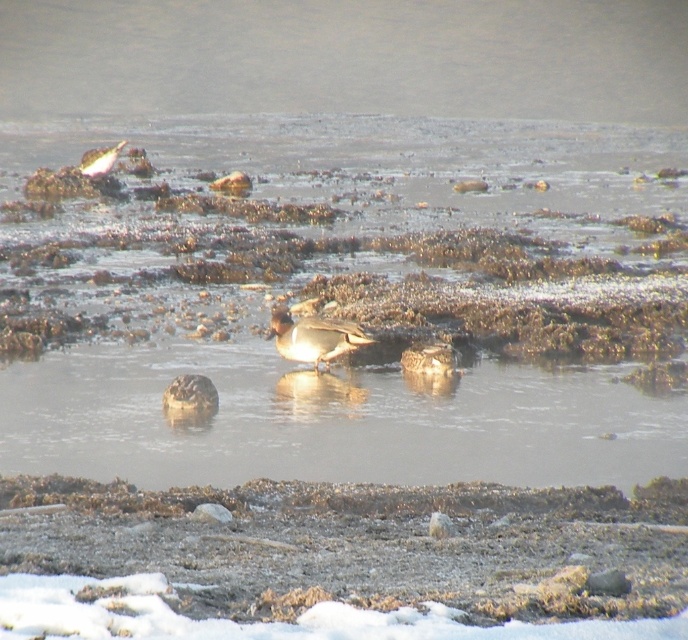
Does clear water at center have a larger size compared to brown speckled duck at center?

Correct, clear water at center is larger in size than brown speckled duck at center.

Find the location of a particular element. clear water at center is located at coordinates (327, 275).

I want to click on clear water at center, so click(327, 275).

Does brown feathered duck at center appear over brown feathered duck at upper left?

No, brown feathered duck at center is not above brown feathered duck at upper left.

Locate an element on the screen. brown feathered duck at center is located at coordinates (314, 337).

Where is `brown feathered duck at center`? brown feathered duck at center is located at coordinates (314, 337).

Image resolution: width=688 pixels, height=640 pixels. I want to click on brown feathered duck at center, so click(314, 337).

Where is `clear water at center`? clear water at center is located at coordinates (327, 275).

From the picture: Who is positioned more to the left, clear water at center or brown feathered duck at upper left?

brown feathered duck at upper left is more to the left.

You are a GUI agent. You are given a task and a screenshot of the screen. Output one action in this format:
    pyautogui.click(x=<x>, y=<y>)
    Task: Click on the clear water at center
    
    Given the screenshot: What is the action you would take?
    pyautogui.click(x=327, y=275)